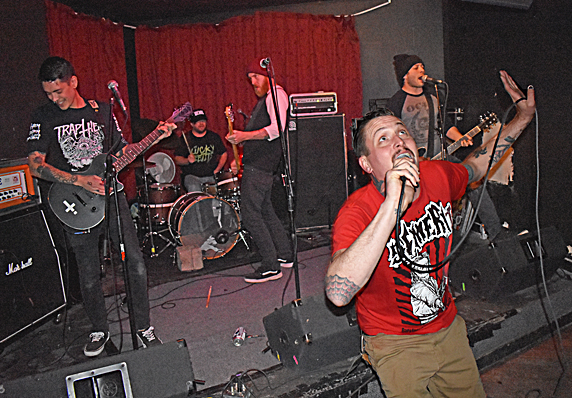
Locate an element on the screen. amplifier is located at coordinates pos(168,370), pos(323,331), pos(502,257), pos(328,166), pos(46,278).